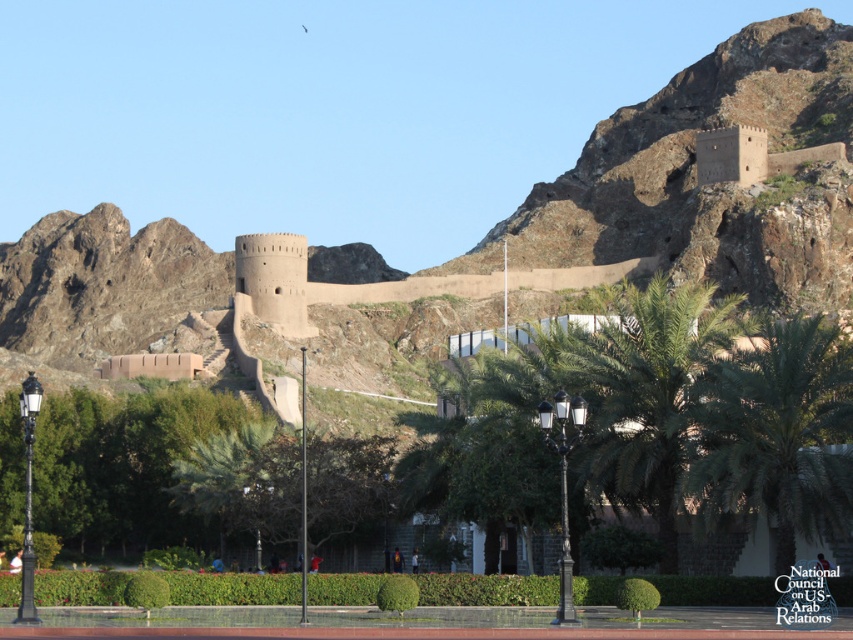
Question: Is green leafy palm tree at center further to camera compared to green leafy palm at center?

Choices:
 (A) yes
 (B) no

Answer: (B)

Question: Which point is farther to the camera?

Choices:
 (A) green leafy palm tree at center
 (B) green leafy palm at center

Answer: (B)

Question: Considering the relative positions of green leafy palm tree at center and green leafy palm at center in the image provided, where is green leafy palm tree at center located with respect to green leafy palm at center?

Choices:
 (A) left
 (B) right

Answer: (B)

Question: Among these points, which one is farthest from the camera?

Choices:
 (A) (825, 476)
 (B) (654, 353)

Answer: (B)

Question: Which of the following is the closest to the observer?

Choices:
 (A) green leafy palm at center
 (B) green leafy palm tree at center

Answer: (B)

Question: From the image, what is the correct spatial relationship of green leafy palm tree at center in relation to green leafy palm at center?

Choices:
 (A) below
 (B) above

Answer: (B)